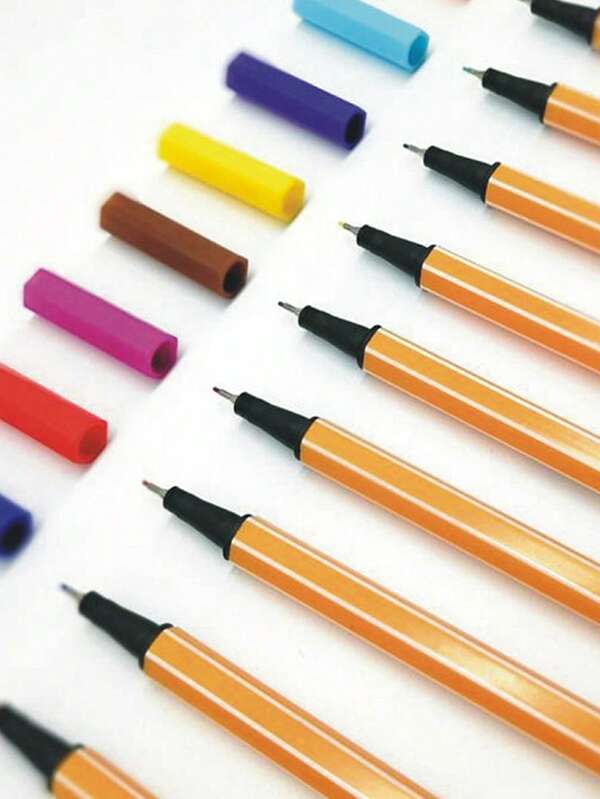
Find the location of `number of pens`. number of pens is located at coordinates tap(77, 778), tap(204, 685), tap(298, 562), tap(354, 460), tap(404, 360), tap(463, 269), tap(518, 175), tap(563, 97), tap(598, 24).